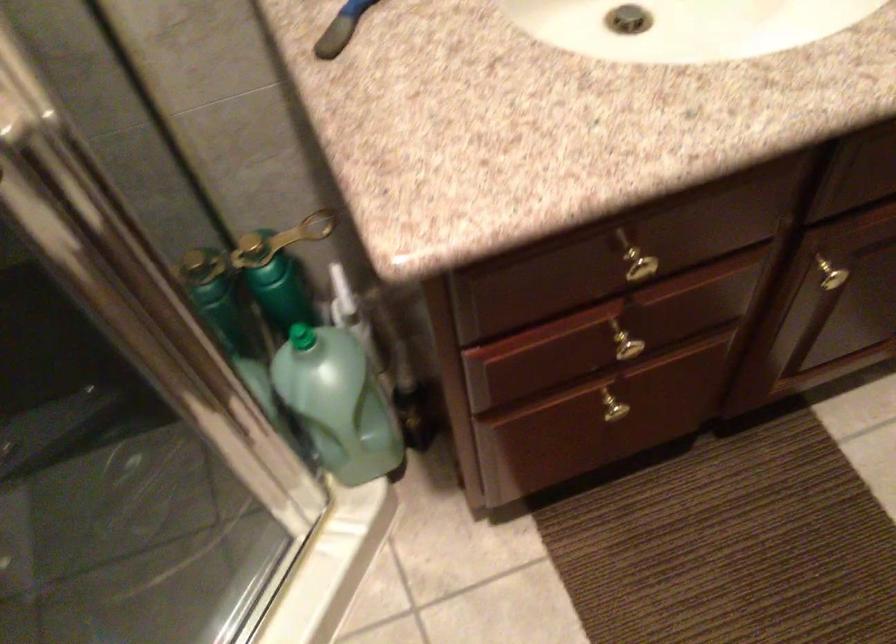
What do you see at coordinates (338, 402) in the screenshot? I see `the gold bottle pump` at bounding box center [338, 402].